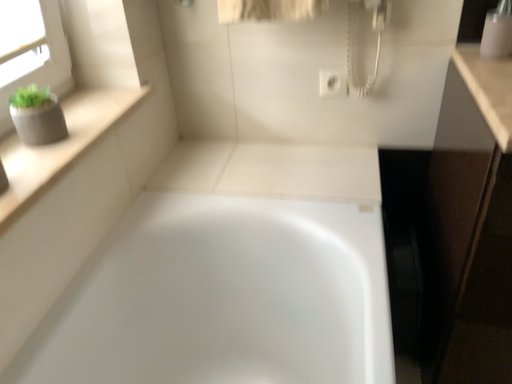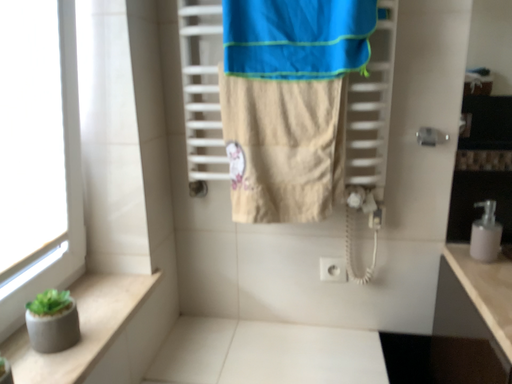
Question: How did the camera likely rotate when shooting the video?

Choices:
 (A) rotated downward
 (B) rotated upward

Answer: (B)